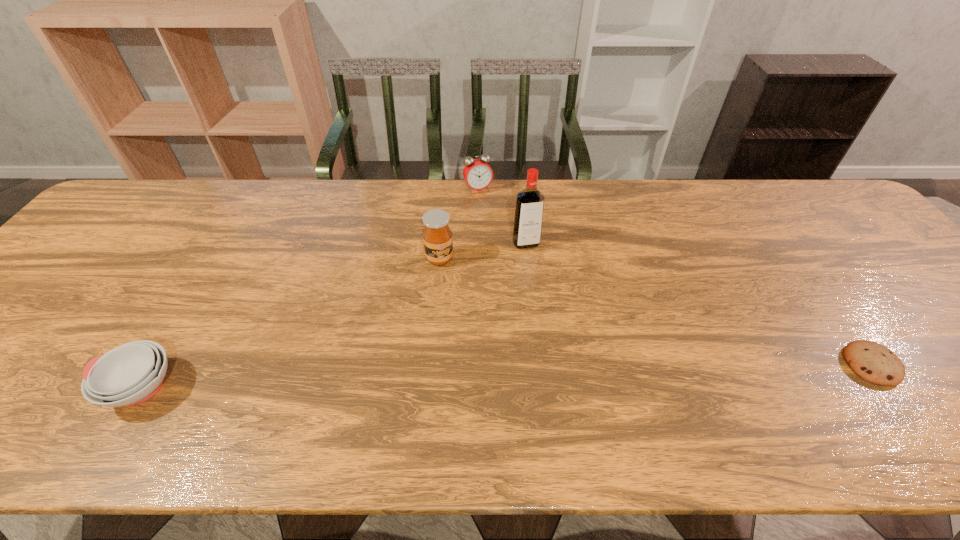
Image resolution: width=960 pixels, height=540 pixels. In order to click on free spot that satisfies the following two spatial constraints: 1. on the front side of the second object from right to left; 2. on the left side of the shortest object in this screenshot , I will do `click(540, 364)`.